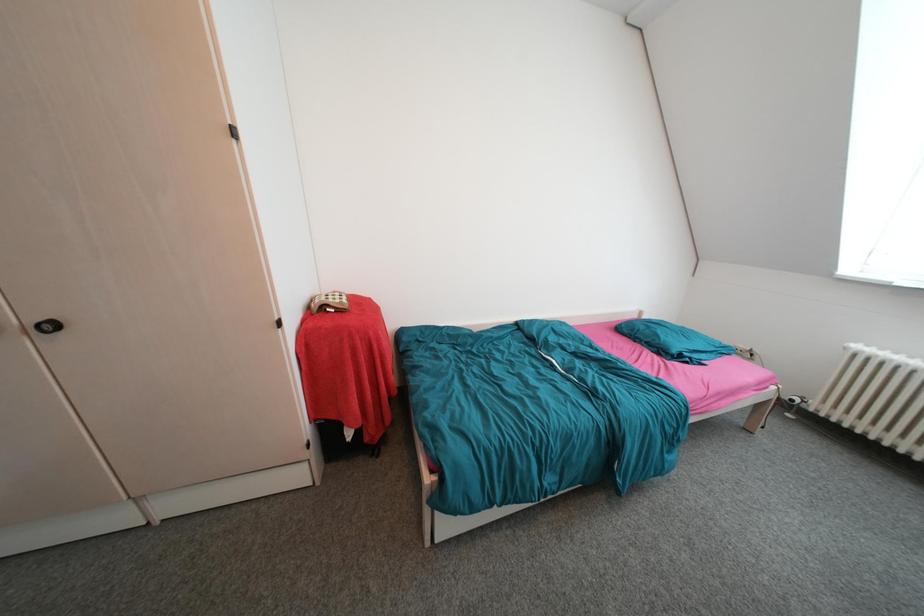
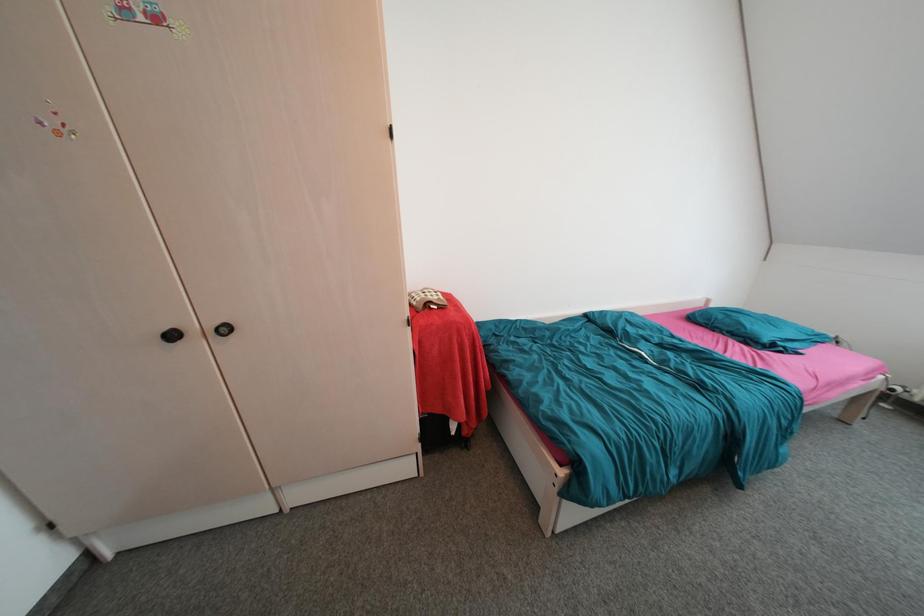
Question: How did the camera likely rotate?

Choices:
 (A) Left
 (B) Right
 (C) Up
 (D) Down

Answer: (A)